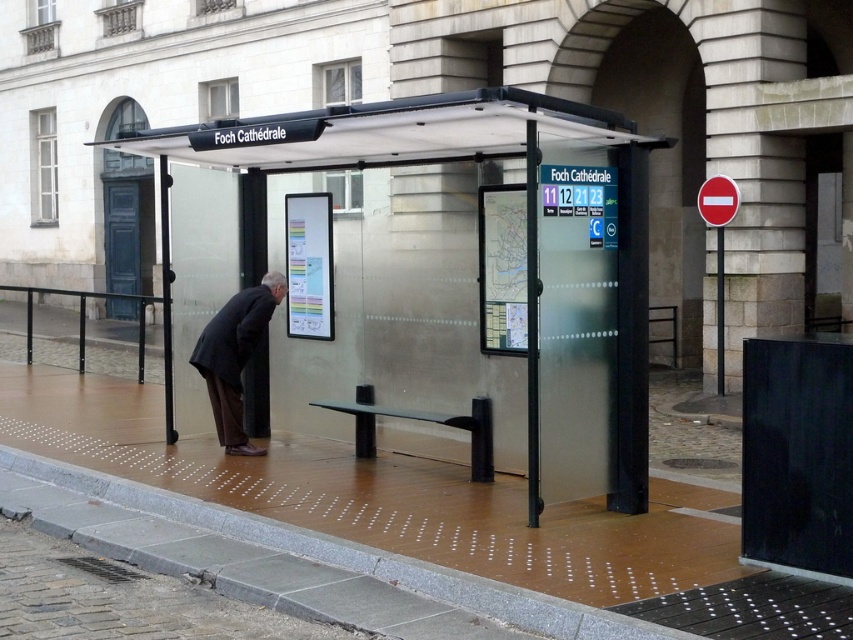
Can you confirm if transparent glass bus stop at center is wider than dark gray suit at center?

No, transparent glass bus stop at center is not wider than dark gray suit at center.

Can you confirm if transparent glass bus stop at center is shorter than dark gray suit at center?

Incorrect, transparent glass bus stop at center's height does not fall short of dark gray suit at center's.

The width and height of the screenshot is (853, 640). I want to click on transparent glass bus stop at center, so click(x=459, y=160).